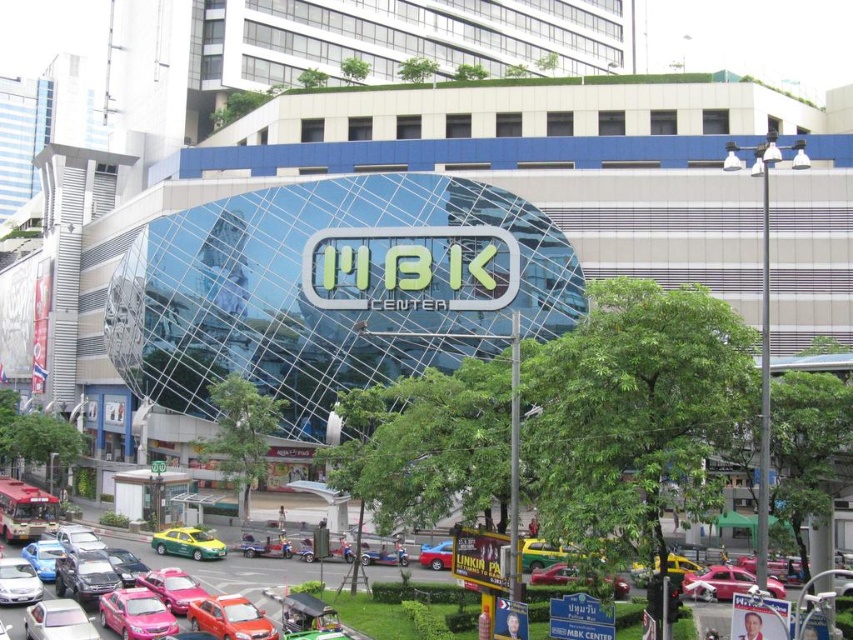
Question: Can you confirm if metallic pink car at center is thinner than metallic silver car at lower center?

Choices:
 (A) yes
 (B) no

Answer: (A)

Question: Among these objects, which one is farthest from the camera?

Choices:
 (A) metallic green taxi at center
 (B) metallic silver car at center
 (C) metallic red car at center
 (D) green matte taxi at lower left

Answer: (D)

Question: Estimate the real-world distances between objects in this image. Which object is closer to the metallic green taxi at center?

Choices:
 (A) pink glossy car at center
 (B) metallic red car at center
 (C) shiny metallic taxi at center

Answer: (B)

Question: Can you confirm if shiny metallic taxi at center is smaller than green matte taxi at lower left?

Choices:
 (A) no
 (B) yes

Answer: (A)

Question: From the image, what is the correct spatial relationship of metallic cars at lower left in relation to metallic silver car at center?

Choices:
 (A) right
 (B) left

Answer: (B)

Question: Estimate the real-world distances between objects in this image. Which object is closer to the metallic green taxi at center?

Choices:
 (A) metallic silver car at lower center
 (B) yellow metallic taxi at center
 (C) metallic silver car at lower left

Answer: (B)